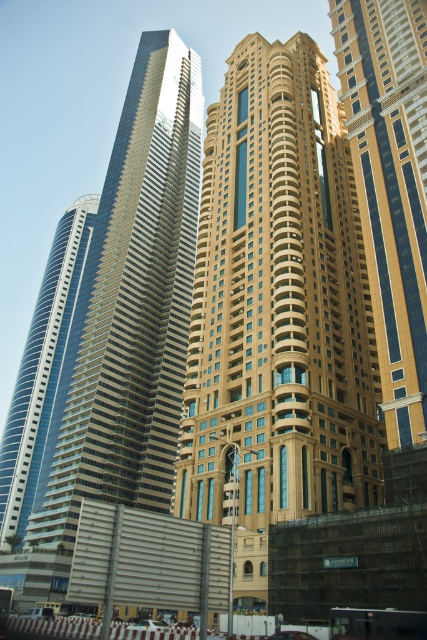
Which is more to the right, shiny glass skyscraper at center or shiny blue glass skyscraper at left?

shiny glass skyscraper at center is more to the right.

Which is behind, point (181, 376) or point (2, 502)?

The point (2, 502) is more distant.

Who is more forward, (167, 202) or (50, 397)?

Point (167, 202) is more forward.

At what (x,y) coordinates should I click in order to perform the action: click on shiny glass skyscraper at center. Please return your answer as a coordinate pair (x, y). The height and width of the screenshot is (640, 427). Looking at the image, I should click on (129, 307).

Is point (415, 337) closer to camera compared to point (76, 257)?

That is True.

Can you confirm if gold/beige stone building at center is positioned to the left of shiny blue glass skyscraper at left?

Incorrect, gold/beige stone building at center is not on the left side of shiny blue glass skyscraper at left.

Who is more forward, (424, 72) or (34, 349)?

Point (424, 72)

Locate an element on the screen. This screenshot has width=427, height=640. gold/beige stone building at center is located at coordinates (389, 188).

Who is positioned more to the right, shiny glass skyscraper at center or gold/beige stone building at center?

Positioned to the right is gold/beige stone building at center.

Can you confirm if shiny glass skyscraper at center is positioned to the right of gold/beige stone building at center?

No, shiny glass skyscraper at center is not to the right of gold/beige stone building at center.

The height and width of the screenshot is (640, 427). Describe the element at coordinates (129, 307) in the screenshot. I see `shiny glass skyscraper at center` at that location.

Where is `shiny glass skyscraper at center`? The image size is (427, 640). shiny glass skyscraper at center is located at coordinates (129, 307).